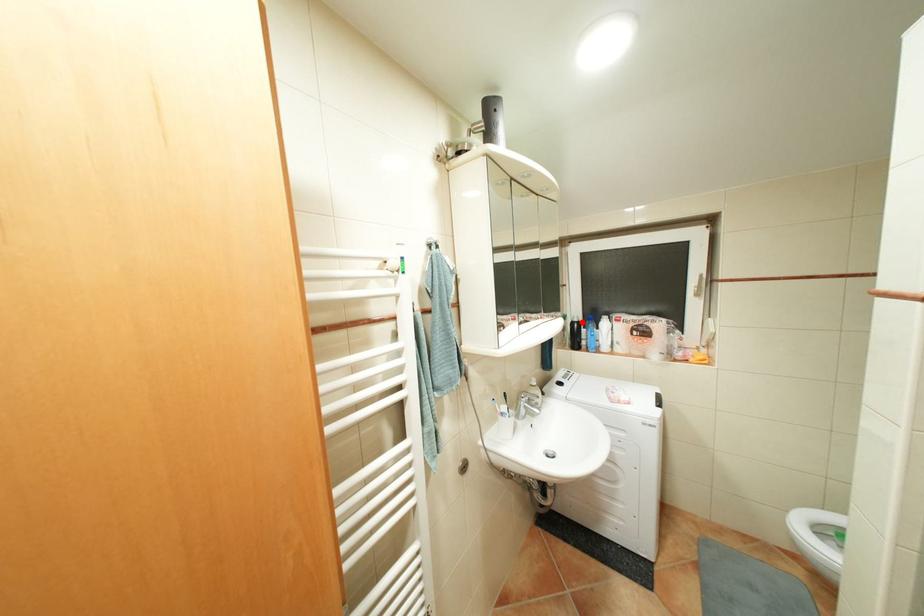
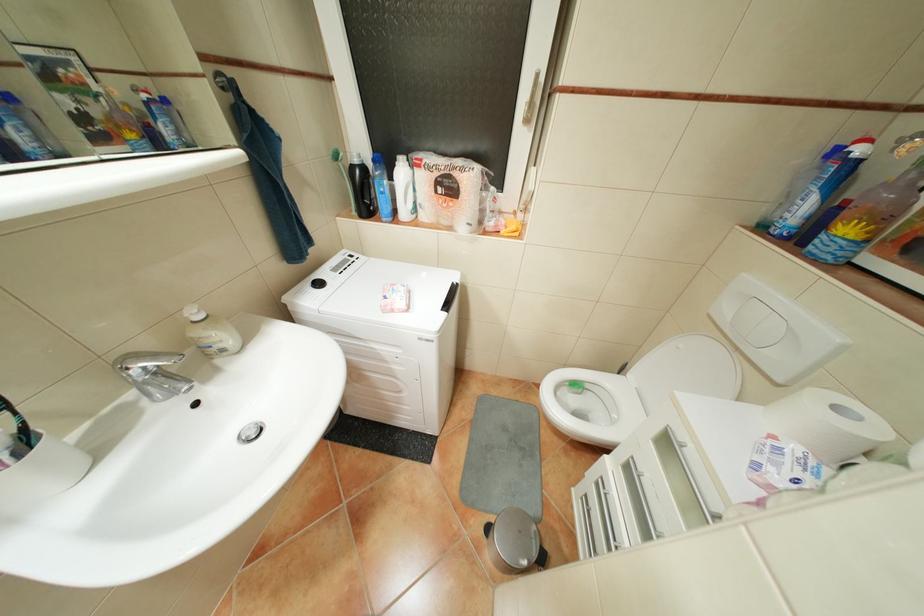
Question: I am providing you with two images of the same scene from different viewpoints. In image1, a red point is highlighted. Considering the same 3D point in image2, which of the following is correct?

Choices:
 (A) It is closer
 (B) It is farther

Answer: (A)